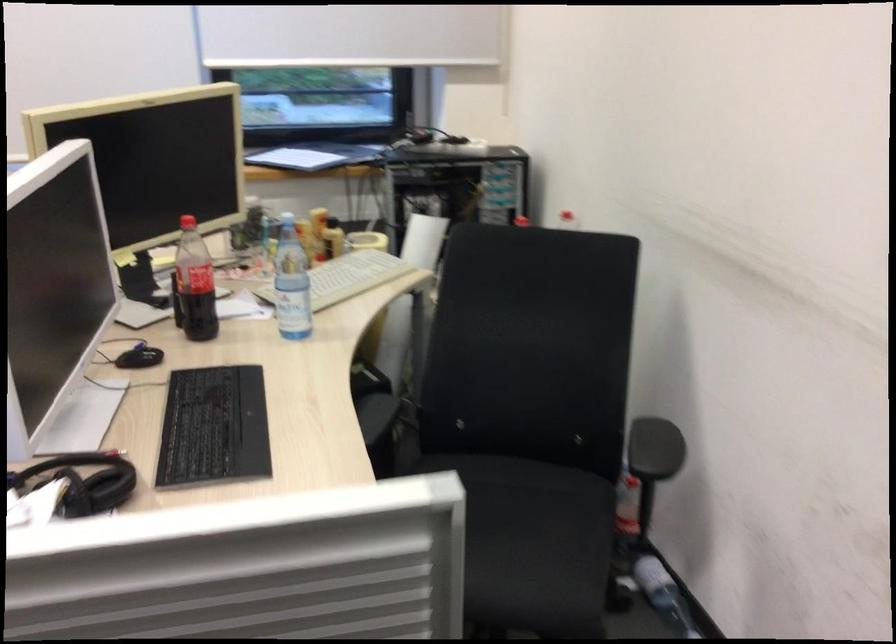
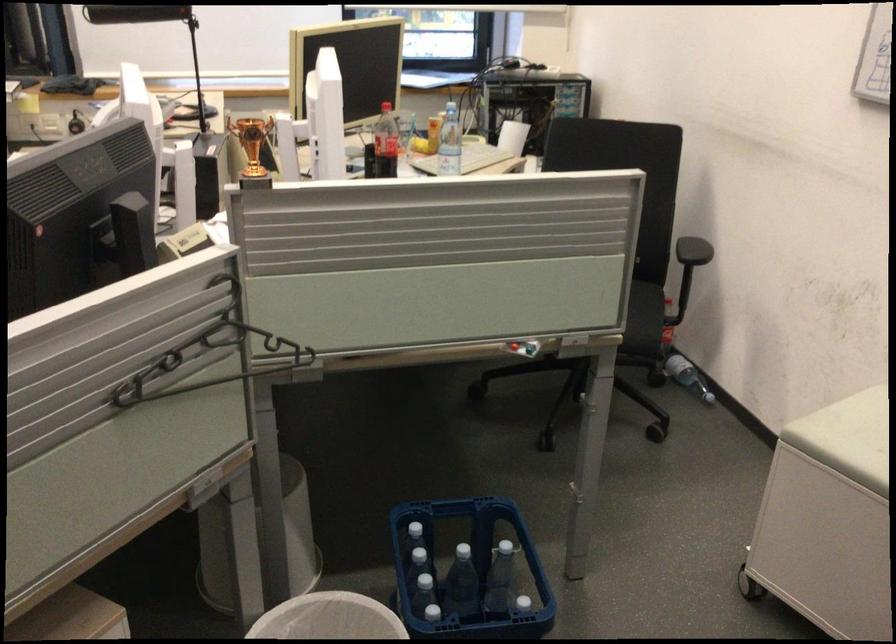
In the second image, find the point that corresponds to pixel 595 567 in the first image.

(648, 319)